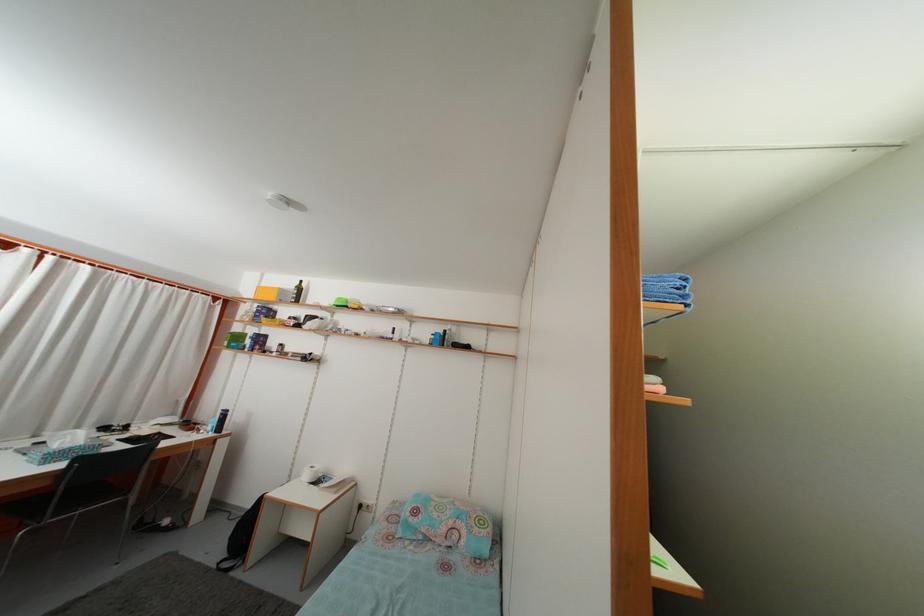
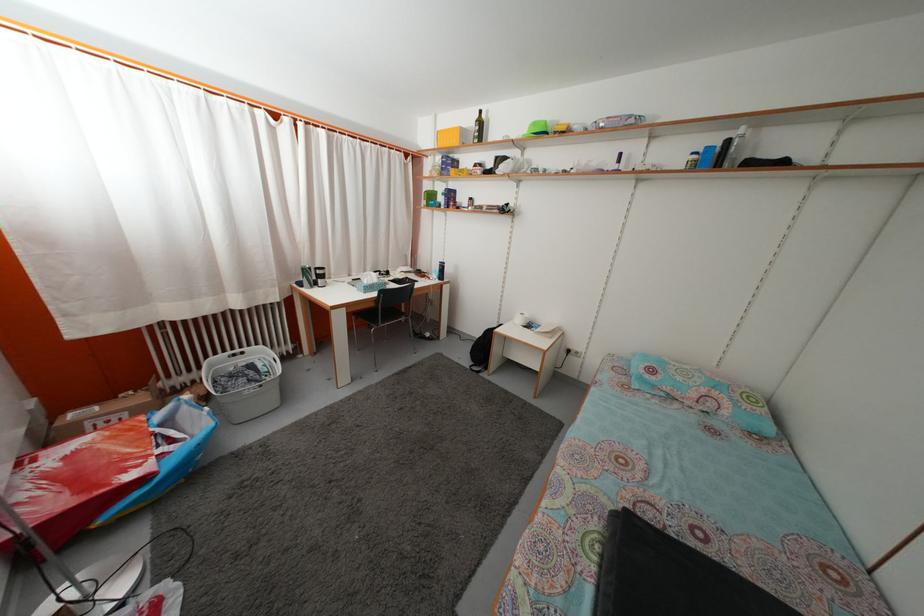
The point at (286, 299) is marked in the first image. Where is the corresponding point in the second image?

(468, 139)